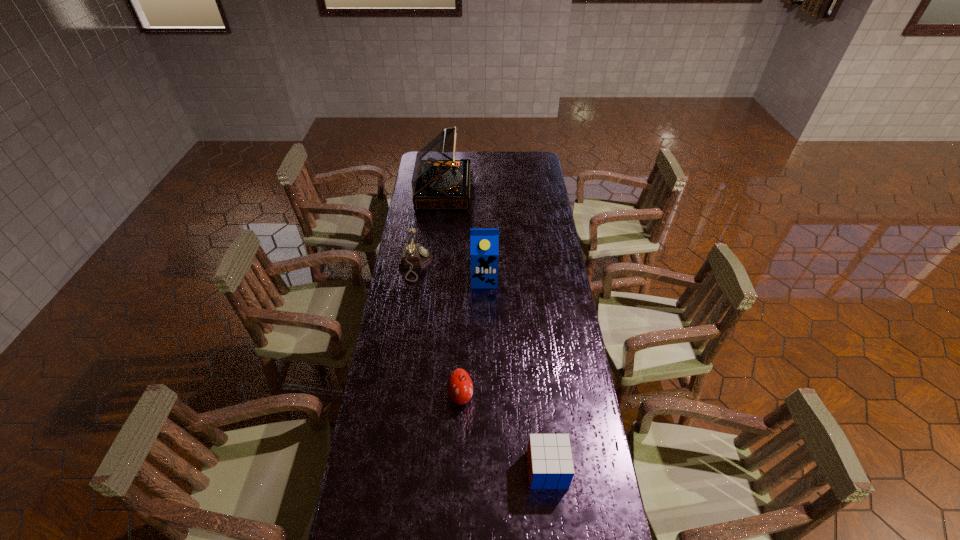
You are a GUI agent. You are given a task and a screenshot of the screen. Output one action in this format:
    pyautogui.click(x=<x>, y=<y>)
    Task: Click on the object that ranks as the third closest to the telephone
    
    Given the screenshot: What is the action you would take?
    pyautogui.click(x=459, y=386)

At what (x,y) coordinates should I click in order to perform the action: click on free location that satisfies the following two spatial constraints: 1. on the front-facing side of the farthest object; 2. on the left side of the nearest object. Please return your answer as a coordinate pair (x, y). This screenshot has width=960, height=540. Looking at the image, I should click on (416, 469).

What are the coordinates of `free space that satisfies the following two spatial constraints: 1. with the cap open on the nearest object; 2. on the left side of the carton` in the screenshot? It's located at (486, 469).

In order to click on free point that satisfies the following two spatial constraints: 1. on the front-facing side of the nearest object; 2. on the left side of the record player in this screenshot , I will do `click(416, 469)`.

This screenshot has height=540, width=960. Identify the location of free space that satisfies the following two spatial constraints: 1. on the dial of the rightmost object; 2. on the right side of the telephone. (385, 469).

You are a GUI agent. You are given a task and a screenshot of the screen. Output one action in this format:
    pyautogui.click(x=<x>, y=<y>)
    Task: Click on the vacant position in the image that satisfies the following two spatial constraints: 1. on the front side of the cube; 2. on the right side of the fourth farthest object
    The height and width of the screenshot is (540, 960).
    Given the screenshot: What is the action you would take?
    pyautogui.click(x=458, y=469)

Where is `vacant space that satisfies the following two spatial constraints: 1. on the dial of the telephone; 2. on the back side of the rightmost object`? The height and width of the screenshot is (540, 960). vacant space that satisfies the following two spatial constraints: 1. on the dial of the telephone; 2. on the back side of the rightmost object is located at coordinates (385, 469).